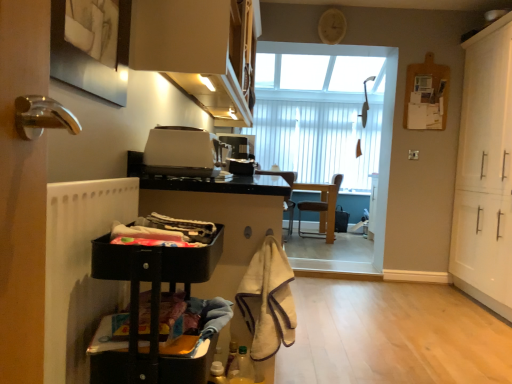
What do you see at coordinates (164, 232) in the screenshot? I see `matte black laundry basket at lower left, the 1th laundry in the top-to-bottom sequence` at bounding box center [164, 232].

Where is `satin black toaster at center, which is the second appliance from front to back`? The height and width of the screenshot is (384, 512). satin black toaster at center, which is the second appliance from front to back is located at coordinates (241, 166).

How much space does brown leather chair at center, placed as the 1th chair when sorted from left to right, occupy horizontally?

brown leather chair at center, placed as the 1th chair when sorted from left to right, is 23.29 inches wide.

What is the approximate height of plastic basket at lower left, which is counted as the first laundry, starting from the bottom?

plastic basket at lower left, which is counted as the first laundry, starting from the bottom, is 8.14 centimeters tall.

This screenshot has width=512, height=384. Describe the element at coordinates (320, 109) in the screenshot. I see `white vertical blinds at center` at that location.

Locate an element on the screen. The image size is (512, 384). matte black laundry basket at lower left, the 1th laundry in the top-to-bottom sequence is located at coordinates (164, 232).

Is point (179, 63) closer or farther from the camera than point (307, 144)?

Point (179, 63) is closer to the camera than point (307, 144).

Which object is further away from the camera taking this photo, matte white cabinet at upper center, the 2th cabinetry positioned from the right, or white vertical blinds at center?

white vertical blinds at center.

Consider the image. Is matte white cabinet at upper center, the 2th cabinetry positioned from the left, oriented away from white vertical blinds at center?

No, matte white cabinet at upper center, the 2th cabinetry positioned from the left, is not facing away from white vertical blinds at center.

Between white matte toaster at center, which ranks as the first appliance in front-to-back order, and white vertical blinds at center, which one is positioned behind?

white vertical blinds at center is further from the camera.

Which is more to the right, white matte toaster at center, which is counted as the second appliance, starting from the back, or white vertical blinds at center?

white vertical blinds at center.

From the image's perspective, who appears lower, white matte toaster at center, which is counted as the second appliance, starting from the back, or white vertical blinds at center?

white matte toaster at center, which is counted as the second appliance, starting from the back, from the image's perspective.

Which object is positioned more to the left, plastic basket at lower left, the second laundry positioned from the top, or brown leather chair at center, positioned as the 1th chair in right-to-left order?

Positioned to the left is plastic basket at lower left, the second laundry positioned from the top.

Is plastic basket at lower left, which is counted as the first laundry, starting from the bottom, not near brown leather chair at center, positioned as the 1th chair in right-to-left order?

Yes, plastic basket at lower left, which is counted as the first laundry, starting from the bottom, is far from brown leather chair at center, positioned as the 1th chair in right-to-left order.

Can you confirm if plastic basket at lower left, which is counted as the first laundry, starting from the bottom, is bigger than brown leather chair at center, positioned as the 1th chair in right-to-left order?

Incorrect, plastic basket at lower left, which is counted as the first laundry, starting from the bottom, is not larger than brown leather chair at center, positioned as the 1th chair in right-to-left order.

Is plastic basket at lower left, the second laundry positioned from the top, thinner than brown leather chair at center, marked as the 2th chair in a left-to-right arrangement?

Yes.

Is white vertical blinds at center closer to the viewer compared to matte black laundry basket at lower left, the 1th laundry in the top-to-bottom sequence?

No, white vertical blinds at center is further to the viewer.

Is white vertical blinds at center oriented away from matte black laundry basket at lower left, the 1th laundry in the top-to-bottom sequence?

No, matte black laundry basket at lower left, the 1th laundry in the top-to-bottom sequence, is not at the back of white vertical blinds at center.

From the image's perspective, which one is positioned higher, white vertical blinds at center or matte black laundry basket at lower left, arranged as the 2th laundry when ordered from the bottom?

white vertical blinds at center is shown above in the image.

Would you consider white vertical blinds at center to be distant from matte black laundry basket at lower left, the 1th laundry in the top-to-bottom sequence?

white vertical blinds at center is positioned a significant distance from matte black laundry basket at lower left, the 1th laundry in the top-to-bottom sequence.

Is white matte radiator at left positioned beyond the bounds of matte white cabinet at upper center, the 2th cabinetry positioned from the left?

Absolutely, white matte radiator at left is external to matte white cabinet at upper center, the 2th cabinetry positioned from the left.

Is point (84, 265) farther from viewer compared to point (198, 7)?

No, (84, 265) is in front of (198, 7).

Who is shorter, white matte radiator at left or matte white cabinet at upper center, the 2th cabinetry positioned from the right?

Standing shorter between the two is white matte radiator at left.

Can you tell me how much white matte radiator at left and matte white cabinet at upper center, the 2th cabinetry positioned from the left, differ in facing direction?

0.189 degrees.

Would you say matte white cabinet at upper center, the 2th cabinetry positioned from the left, is inside or outside white matte radiator at left?

matte white cabinet at upper center, the 2th cabinetry positioned from the left, is not inside white matte radiator at left, it's outside.

Does matte white cabinet at upper center, the 2th cabinetry positioned from the left, have a larger size compared to white matte radiator at left?

Yes, matte white cabinet at upper center, the 2th cabinetry positioned from the left, is bigger than white matte radiator at left.

Is matte white cabinet at upper center, the 2th cabinetry positioned from the left, to the left of white matte radiator at left from the viewer's perspective?

No, matte white cabinet at upper center, the 2th cabinetry positioned from the left, is not to the left of white matte radiator at left.

What's the angular difference between white matte toaster at center, which is counted as the second appliance, starting from the back, and satin black toaster at center, acting as the first appliance starting from the back,'s facing directions?

The angle between the facing direction of white matte toaster at center, which is counted as the second appliance, starting from the back, and the facing direction of satin black toaster at center, acting as the first appliance starting from the back, is 2.87 degrees.

Find the location of a particular element. The width and height of the screenshot is (512, 384). appliance in front of the satin black toaster at center, which is the second appliance from front to back is located at coordinates (184, 152).

Looking at this image, from the image's perspective, relative to satin black toaster at center, acting as the first appliance starting from the back, is white matte toaster at center, which is counted as the second appliance, starting from the back, above or below?

Clearly, from the image's perspective, white matte toaster at center, which is counted as the second appliance, starting from the back, is below satin black toaster at center, acting as the first appliance starting from the back.

Considering the positions of objects white matte toaster at center, which is counted as the second appliance, starting from the back, and satin black toaster at center, acting as the first appliance starting from the back, in the image provided, who is more to the right, white matte toaster at center, which is counted as the second appliance, starting from the back, or satin black toaster at center, acting as the first appliance starting from the back,?

satin black toaster at center, acting as the first appliance starting from the back.

This screenshot has height=384, width=512. Find the location of `window below the matte white cabinet at upper center, the 2th cabinetry positioned from the left (from the image's perspective)`. window below the matte white cabinet at upper center, the 2th cabinetry positioned from the left (from the image's perspective) is located at coordinates (320, 109).

Which appliance is the 2nd one when counting from the left side of the white vertical blinds at center? Please provide its 2D coordinates.

[(184, 152)]

Which object lies nearer to the anchor point brown leather chair at center, the 2th chair in the right-to-left sequence, white vertical blinds at center or black plastic cart at lower left, positioned as the first cabinetry in left-to-right order?

white vertical blinds at center is positioned closer to the anchor brown leather chair at center, the 2th chair in the right-to-left sequence.

When comparing their distances from white matte radiator at left, does white matte toaster at center, which is counted as the second appliance, starting from the back, or satin black toaster at center, acting as the first appliance starting from the back, seem closer?

white matte toaster at center, which is counted as the second appliance, starting from the back.

Which object lies further to the anchor point brown leather chair at center, placed as the 1th chair when sorted from left to right, matte white cabinet at upper center, the 2th cabinetry positioned from the right, or beige fuzzy towel at lower center?

beige fuzzy towel at lower center is positioned further to the anchor brown leather chair at center, placed as the 1th chair when sorted from left to right.

From the image, which object appears to be nearer to white matte toaster at center, which is counted as the second appliance, starting from the back, white matte radiator at left or brown leather chair at center, positioned as the 1th chair in right-to-left order?

white matte radiator at left is closer to white matte toaster at center, which is counted as the second appliance, starting from the back.

Looking at the image, which one is located further to matte white cabinet at upper center, the 2th cabinetry positioned from the left, white matte cabinet at right, the third cabinetry from the left, or satin black toaster at center, acting as the first appliance starting from the back?

white matte cabinet at right, the third cabinetry from the left.

Which object lies further to the anchor point matte black laundry basket at lower left, the 1th laundry in the top-to-bottom sequence, white matte radiator at left or black plastic cart at lower left, arranged as the third cabinetry when viewed from the right?

white matte radiator at left is positioned further to the anchor matte black laundry basket at lower left, the 1th laundry in the top-to-bottom sequence.

Looking at the image, which one is located closer to matte white cabinet at upper center, the 2th cabinetry positioned from the right, satin black toaster at center, acting as the first appliance starting from the back, or plastic basket at lower left, which is counted as the first laundry, starting from the bottom?

Among the two, satin black toaster at center, acting as the first appliance starting from the back, is located nearer to matte white cabinet at upper center, the 2th cabinetry positioned from the right.

Looking at the image, which one is located closer to white matte cabinet at right, which ranks as the 1th cabinetry in right-to-left order, beige fuzzy towel at lower center or brown leather chair at center, marked as the 2th chair in a left-to-right arrangement?

Among the two, brown leather chair at center, marked as the 2th chair in a left-to-right arrangement, is located nearer to white matte cabinet at right, which ranks as the 1th cabinetry in right-to-left order.

Find the location of a particular element. The height and width of the screenshot is (384, 512). appliance between white matte toaster at center, which ranks as the first appliance in front-to-back order, and brown leather chair at center, positioned as the 1th chair in right-to-left order, in the front-back direction is located at coordinates (241, 166).

You are a GUI agent. You are given a task and a screenshot of the screen. Output one action in this format:
    pyautogui.click(x=<x>, y=<y>)
    Task: Click on the chair between plastic basket at lower left, which is counted as the first laundry, starting from the bottom, and brown leather chair at center, marked as the 2th chair in a left-to-right arrangement, along the z-axis
    The width and height of the screenshot is (512, 384).
    Given the screenshot: What is the action you would take?
    pyautogui.click(x=288, y=195)

Find the location of `cabinetry located between white matte toaster at center, which ranks as the first appliance in front-to-back order, and brown leather chair at center, positioned as the 1th chair in right-to-left order, in the depth direction`. cabinetry located between white matte toaster at center, which ranks as the first appliance in front-to-back order, and brown leather chair at center, positioned as the 1th chair in right-to-left order, in the depth direction is located at coordinates (485, 172).

Locate an element on the screen. This screenshot has width=512, height=384. material between matte white cabinet at upper center, the 2th cabinetry positioned from the left, and brown leather chair at center, marked as the 2th chair in a left-to-right arrangement, from front to back is located at coordinates (268, 300).